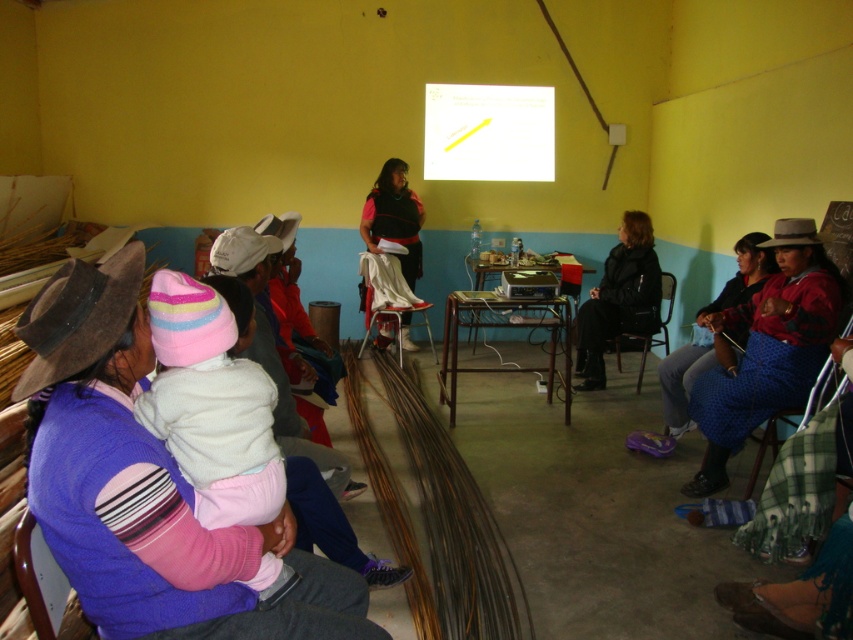
You are an interior designer planning to hang a picture on the wall between the polka dot fabric at lower right and the brown felt cowboy hat at upper right. Which object should you consider for the picture placement to ensure it is above both items?

The polka dot fabric at lower right is much taller than the brown felt cowboy hat at upper right. Therefore, to place the picture above both items, you should position it above the taller object, which is the polka dot fabric at lower right.